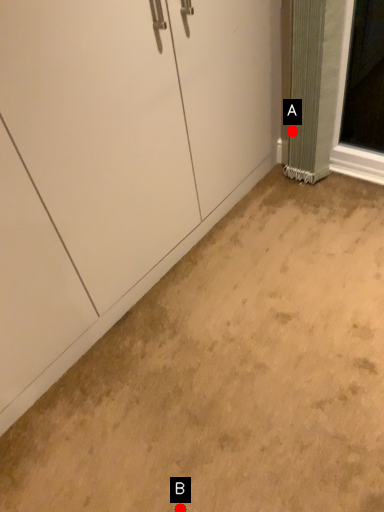
Question: Two points are circled on the image, labeled by A and B beside each circle. Among these points, which one is nearest to the camera?

Choices:
 (A) A is closer
 (B) B is closer

Answer: (B)